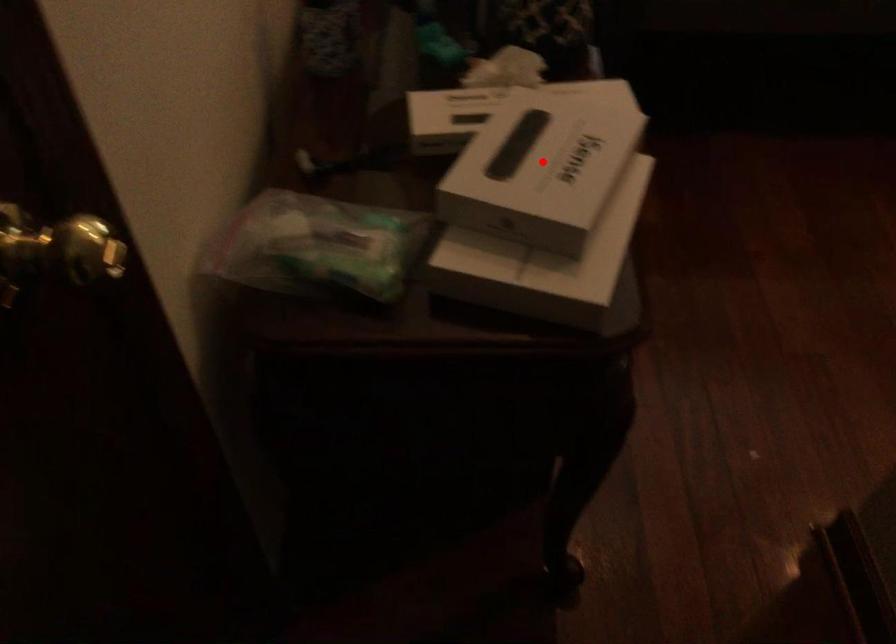
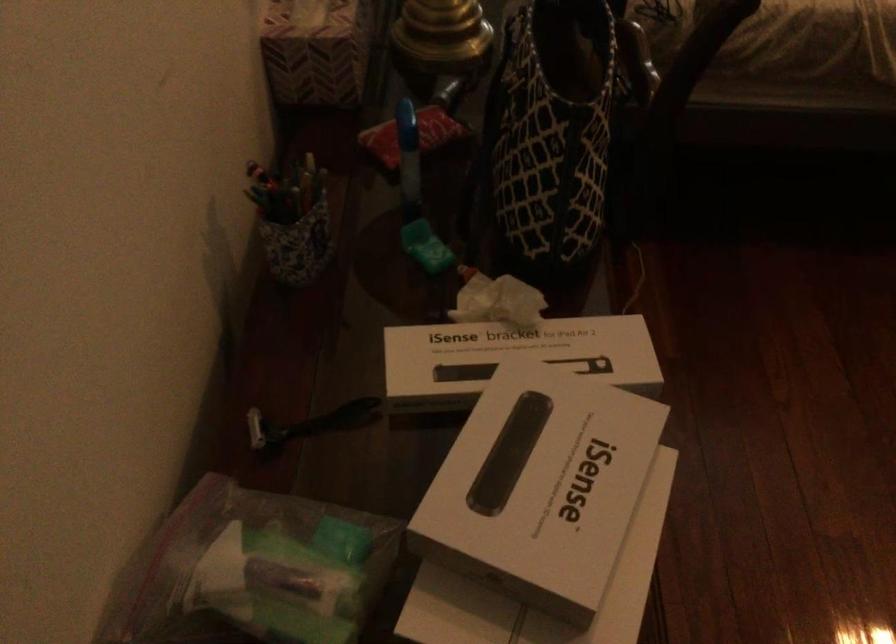
In the second image, find the point that corresponds to the highlighted location in the first image.

(540, 486)